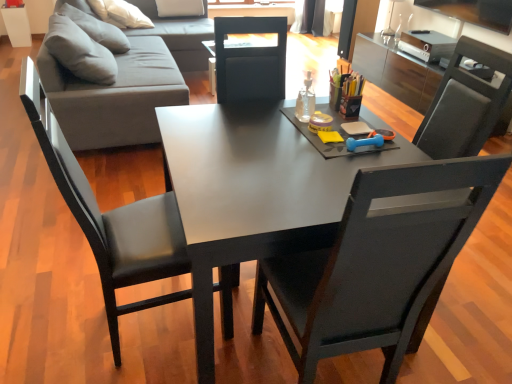
Question: Is black leather chair at center, arranged as the 2th chair when viewed from the left, turned away from matte black desk at center?

Choices:
 (A) no
 (B) yes

Answer: (B)

Question: Could you tell me if black leather chair at center, acting as the first chair starting from the right, is turned towards matte black desk at center?

Choices:
 (A) yes
 (B) no

Answer: (A)

Question: From a real-world perspective, is black leather chair at center, acting as the first chair starting from the right, beneath matte black desk at center?

Choices:
 (A) no
 (B) yes

Answer: (A)

Question: Considering the relative sizes of black leather chair at center, arranged as the 2th chair when viewed from the left, and matte black desk at center in the image provided, is black leather chair at center, arranged as the 2th chair when viewed from the left, taller than matte black desk at center?

Choices:
 (A) no
 (B) yes

Answer: (B)

Question: Is matte black desk at center completely or partially inside black leather chair at center, arranged as the 2th chair when viewed from the left?

Choices:
 (A) no
 (B) yes

Answer: (A)

Question: Does black leather chair at center, arranged as the 2th chair when viewed from the left, have a larger size compared to matte black desk at center?

Choices:
 (A) yes
 (B) no

Answer: (B)

Question: From a real-world perspective, is black leather chair at left, the 2th chair positioned from the right, on top of matte black desk at center?

Choices:
 (A) yes
 (B) no

Answer: (A)

Question: Can you confirm if black leather chair at left, arranged as the 1th chair when viewed from the left, is positioned to the left of matte black desk at center?

Choices:
 (A) yes
 (B) no

Answer: (A)

Question: Is black leather chair at left, the 2th chair positioned from the right, outside matte black desk at center?

Choices:
 (A) yes
 (B) no

Answer: (A)

Question: Considering the relative positions of black leather chair at left, the 2th chair positioned from the right, and matte black desk at center in the image provided, is black leather chair at left, the 2th chair positioned from the right, to the right of matte black desk at center from the viewer's perspective?

Choices:
 (A) yes
 (B) no

Answer: (B)

Question: From a real-world perspective, is black leather chair at left, the 2th chair positioned from the right, positioned under matte black desk at center based on gravity?

Choices:
 (A) no
 (B) yes

Answer: (A)

Question: From the image's perspective, is black leather chair at left, the 2th chair positioned from the right, on top of matte black desk at center?

Choices:
 (A) no
 (B) yes

Answer: (B)

Question: Is transparent glass bottle at center facing away from matte black desk at center?

Choices:
 (A) no
 (B) yes

Answer: (A)